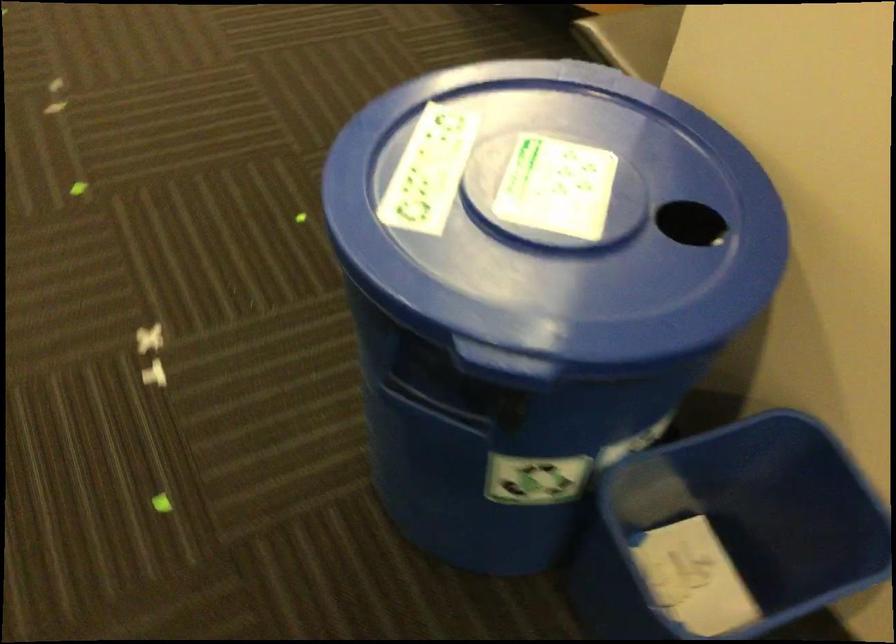
This screenshot has height=644, width=896. I want to click on blue bin lid, so click(561, 220).